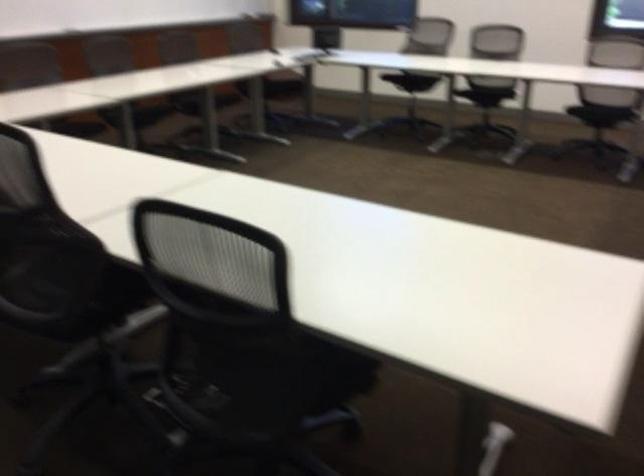
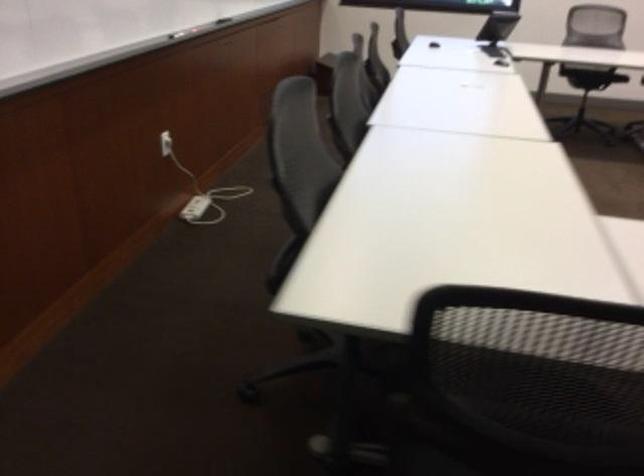
The images are taken continuously from a first-person perspective. In which direction are you moving?

The movement direction of the cameraman is left, forward.